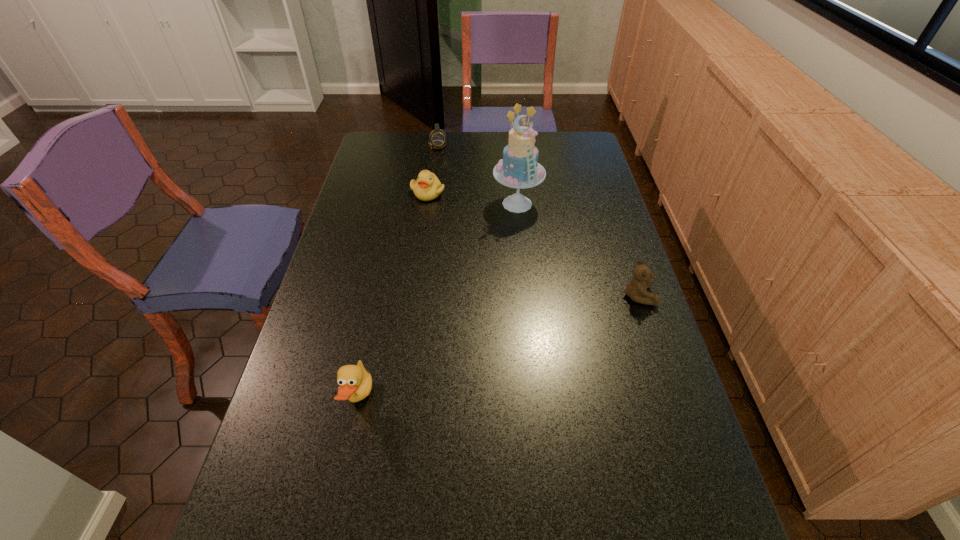
At what (x,y) coordinates should I click in order to perform the action: click on blank area located 0.120m with a ladder on the side of the second object from right to left. Please return your answer as a coordinate pair (x, y). The height and width of the screenshot is (540, 960). Looking at the image, I should click on (519, 243).

Image resolution: width=960 pixels, height=540 pixels. Find the location of `free space located with a ladder on the side of the second object from right to left`. free space located with a ladder on the side of the second object from right to left is located at coordinates click(521, 265).

You are a GUI agent. You are given a task and a screenshot of the screen. Output one action in this format:
    pyautogui.click(x=<x>, y=<y>)
    Task: Click on the vacant space located 0.110m on the face of the farthest object
    The height and width of the screenshot is (540, 960).
    Given the screenshot: What is the action you would take?
    pyautogui.click(x=444, y=166)

You are a GUI agent. You are given a task and a screenshot of the screen. Output one action in this format:
    pyautogui.click(x=<x>, y=<y>)
    Task: Click on the vacant space situated on the face of the farthest object
    The height and width of the screenshot is (540, 960).
    Given the screenshot: What is the action you would take?
    tap(449, 183)

Image resolution: width=960 pixels, height=540 pixels. Identify the location of free spot located 0.300m on the face of the farthest object. (453, 194).

At what (x,y) coordinates should I click in order to perform the action: click on vacant space situated on the beak of the duckling. Please return your answer as a coordinate pair (x, y). Looking at the image, I should click on (437, 224).

Where is `vacant area situated 0.260m on the beak of the duckling`? The height and width of the screenshot is (540, 960). vacant area situated 0.260m on the beak of the duckling is located at coordinates (445, 251).

Identify the location of free space located 0.370m on the beak of the duckling. (452, 276).

I want to click on object that is at the far edge, so click(437, 138).

Locate an element on the screen. object that is at the left edge is located at coordinates (355, 382).